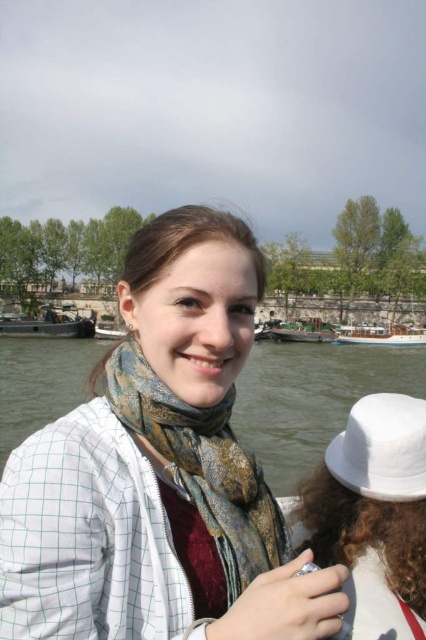
Between printed silk scarf at center and dark gray metallic boat at lower left, which one is positioned lower?

printed silk scarf at center

Is printed silk scarf at center positioned before dark gray metallic boat at lower left?

Yes, printed silk scarf at center is in front of dark gray metallic boat at lower left.

In order to click on printed silk scarf at center in this screenshot , I will do `click(201, 467)`.

Is white checkered shirt at center below green water at lower left?

No.

Between white checkered shirt at center and green water at lower left, which one appears on the right side from the viewer's perspective?

Positioned to the right is white checkered shirt at center.

Is point (213, 460) positioned before point (331, 362)?

Yes, it is.

Where is `white checkered shirt at center`? This screenshot has height=640, width=426. white checkered shirt at center is located at coordinates (160, 470).

Is white matte hat at upper right below dark gray metallic boat at lower left?

Yes.

Which is more to the left, white matte hat at upper right or dark gray metallic boat at lower left?

dark gray metallic boat at lower left is more to the left.

Identify the location of white matte hat at upper right. This screenshot has width=426, height=640. (373, 516).